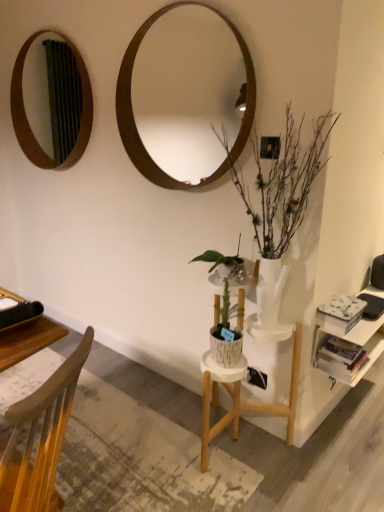
Question: Could you tell me if white matte bookshelf at right is turned towards wooden chair at lower left?

Choices:
 (A) yes
 (B) no

Answer: (B)

Question: Is white matte bookshelf at right taller than wooden chair at lower left?

Choices:
 (A) no
 (B) yes

Answer: (A)

Question: From a real-world perspective, is white matte bookshelf at right positioned over wooden chair at lower left based on gravity?

Choices:
 (A) yes
 (B) no

Answer: (B)

Question: Is white matte bookshelf at right bigger than wooden chair at lower left?

Choices:
 (A) no
 (B) yes

Answer: (A)

Question: From a real-world perspective, is white matte bookshelf at right under wooden chair at lower left?

Choices:
 (A) yes
 (B) no

Answer: (A)

Question: Is white matte bookshelf at right far away from wooden chair at lower left?

Choices:
 (A) yes
 (B) no

Answer: (A)

Question: Can you confirm if white matte book at right, acting as the 1th book starting from the top, is bigger than white glossy vase at right?

Choices:
 (A) yes
 (B) no

Answer: (B)

Question: Does white matte book at right, the 2th book ordered from the bottom, appear on the left side of white glossy vase at right?

Choices:
 (A) yes
 (B) no

Answer: (B)

Question: Does white matte book at right, the 2th book ordered from the bottom, lie behind white glossy vase at right?

Choices:
 (A) no
 (B) yes

Answer: (B)

Question: Is white matte book at right, acting as the 1th book starting from the top, completely or partially outside of white glossy vase at right?

Choices:
 (A) yes
 (B) no

Answer: (A)

Question: Would you say white glossy vase at right is part of white matte book at right, acting as the 1th book starting from the top,'s contents?

Choices:
 (A) no
 (B) yes

Answer: (A)

Question: From a real-world perspective, is white matte book at right, acting as the 1th book starting from the top, positioned under white glossy vase at right based on gravity?

Choices:
 (A) yes
 (B) no

Answer: (A)

Question: Does wooden mirror at upper center, the first mirror viewed from the front, have a greater height compared to white glossy vase at right?

Choices:
 (A) no
 (B) yes

Answer: (A)